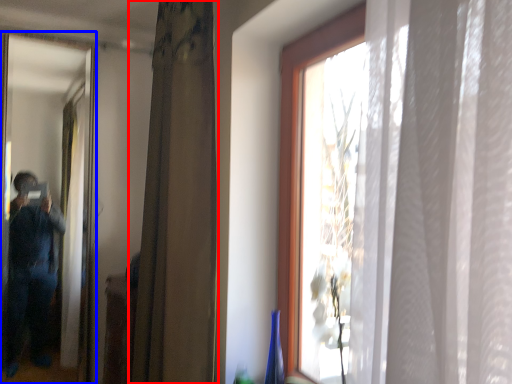
Question: Which of the following is the farthest to the observer, curtain (highlighted by a red box) or mirror (highlighted by a blue box)?

Choices:
 (A) curtain
 (B) mirror

Answer: (B)